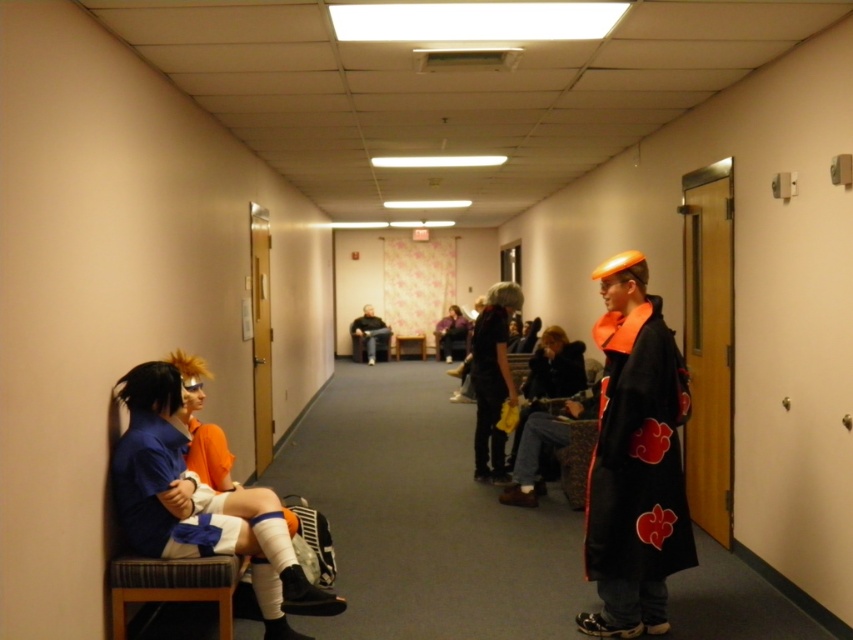
Question: Does dark brown leather jacket at center have a smaller size compared to orange fabric jacket at center?

Choices:
 (A) yes
 (B) no

Answer: (B)

Question: Which of these objects is positioned farthest from the black fabric purse at center?

Choices:
 (A) orange fabric jacket at center
 (B) matte blue shirt at left

Answer: (A)

Question: Among these objects, which one is farthest from the camera?

Choices:
 (A) black fabric purse at center
 (B) matte blue shirt at left
 (C) black matte cape at right

Answer: (A)

Question: Can you confirm if matte blue shirt at left is bigger than orange fabric jacket at center?

Choices:
 (A) no
 (B) yes

Answer: (A)

Question: Can you confirm if black matte cape at right is positioned to the right of black fabric purse at center?

Choices:
 (A) yes
 (B) no

Answer: (A)

Question: Which point appears farthest from the camera in this image?

Choices:
 (A) (372, 356)
 (B) (541, 372)

Answer: (A)